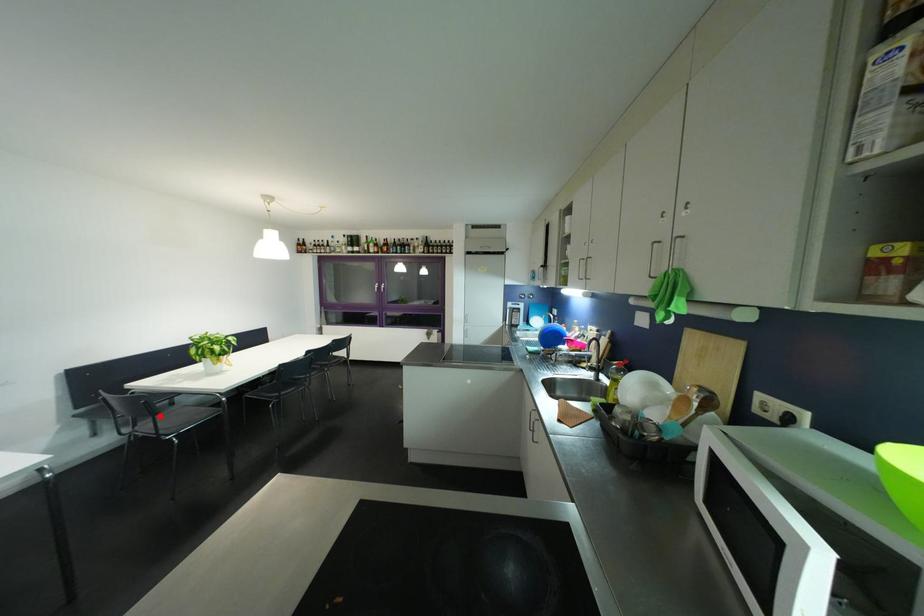
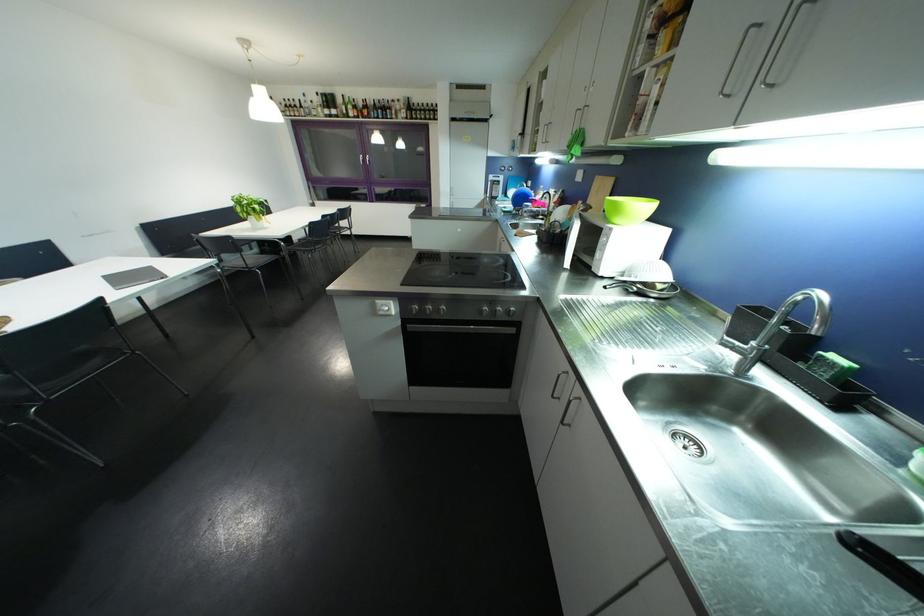
Question: I am providing you with two images of the same scene from different viewpoints. A red point is marked on the first image. At the location where the point appears in image 1, is it still visible in image 2?

Choices:
 (A) Yes
 (B) No

Answer: (A)